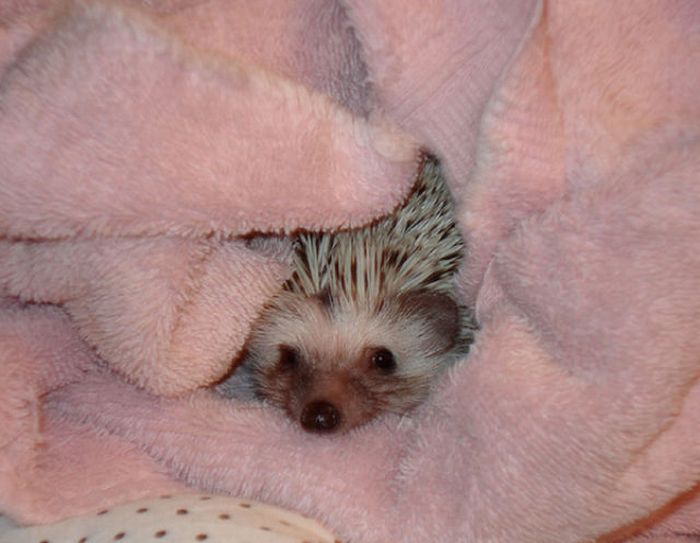
This screenshot has height=543, width=700. Identify the location of big fold in blanket. tap(47, 29).